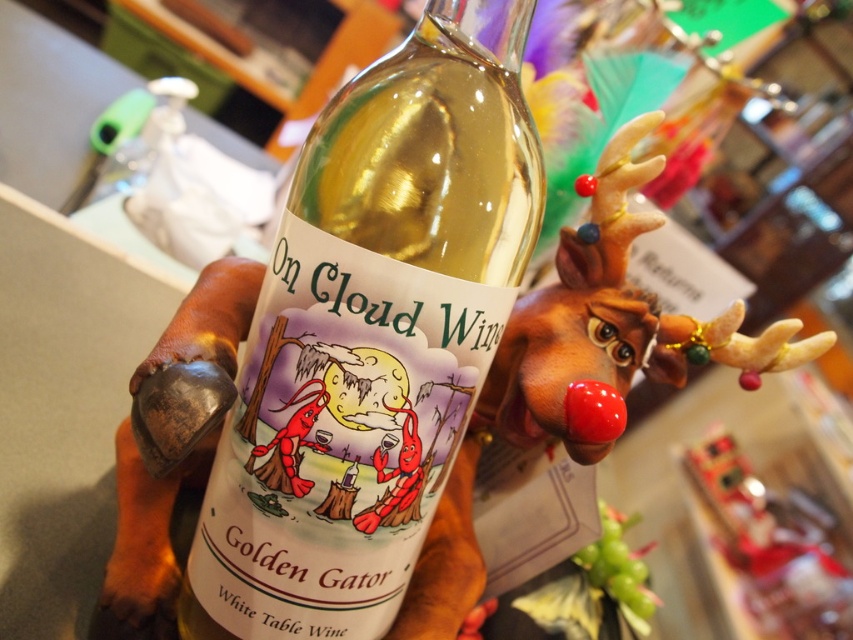
Between translucent glass bottle at center and brown rubber reindeer at center, which one appears on the left side from the viewer's perspective?

translucent glass bottle at center

Does point (357, 512) come closer to viewer compared to point (582, 300)?

Yes, point (357, 512) is in front of point (582, 300).

Image resolution: width=853 pixels, height=640 pixels. I want to click on translucent glass bottle at center, so click(x=372, y=333).